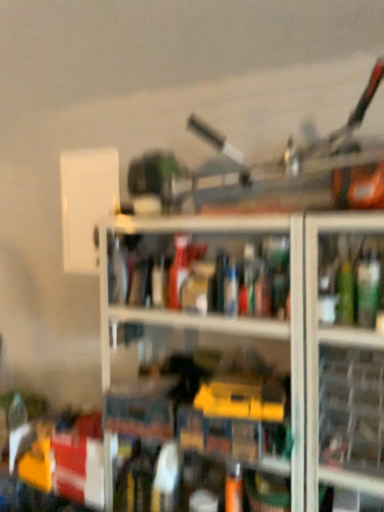
Describe the element at coordinates (169, 231) in the screenshot. I see `clear plastic shelf at center` at that location.

At what (x,y) coordinates should I click in order to perform the action: click on clear plastic shelf at center. Please return your answer as a coordinate pair (x, y). This screenshot has height=512, width=384. Looking at the image, I should click on (169, 231).

The image size is (384, 512). What are the coordinates of `clear plastic shelf at center` in the screenshot? It's located at (169, 231).